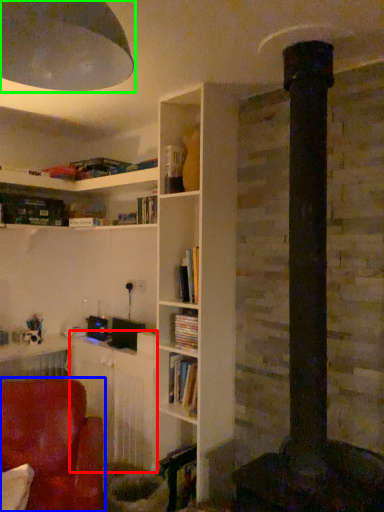
Question: Based on their relative distances, which object is nearer to table (highlighted by a red box)? Choose from chair (highlighted by a blue box) and lamp (highlighted by a green box).

Choices:
 (A) chair
 (B) lamp

Answer: (A)